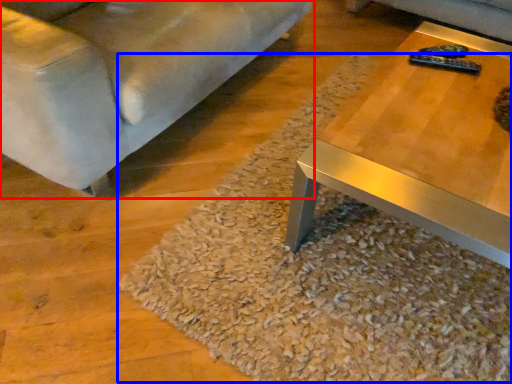
Question: Which point is closer to the camera, studio couch (highlighted by a red box) or gravel (highlighted by a blue box)?

Choices:
 (A) studio couch
 (B) gravel

Answer: (A)